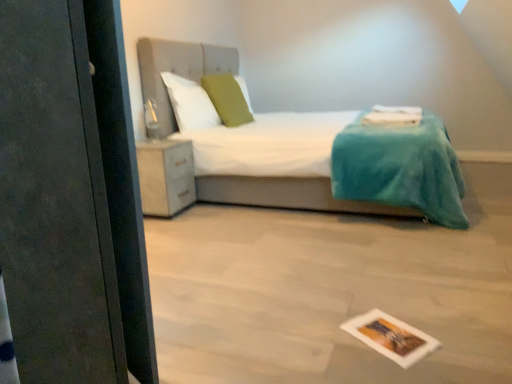
Question: Are matte white cabinet at lower left and green fabric pillow at center, the 1th pillow positioned from the right, beside each other?

Choices:
 (A) yes
 (B) no

Answer: (B)

Question: From the image's perspective, does matte white cabinet at lower left appear lower than green fabric pillow at center, the 1th pillow positioned from the right?

Choices:
 (A) no
 (B) yes

Answer: (B)

Question: Is matte white cabinet at lower left thinner than green fabric pillow at center, the 2th pillow in the left-to-right sequence?

Choices:
 (A) no
 (B) yes

Answer: (A)

Question: Can you confirm if matte white cabinet at lower left is positioned to the left of green fabric pillow at center, the 2th pillow in the left-to-right sequence?

Choices:
 (A) no
 (B) yes

Answer: (B)

Question: Does matte white cabinet at lower left have a smaller size compared to green fabric pillow at center, the 1th pillow positioned from the right?

Choices:
 (A) no
 (B) yes

Answer: (A)

Question: Is matte white cabinet at lower left facing towards green fabric pillow at center, the 1th pillow positioned from the right?

Choices:
 (A) yes
 (B) no

Answer: (B)

Question: Can you confirm if printed paper postcard at lower center is thinner than white fabric bed at center?

Choices:
 (A) no
 (B) yes

Answer: (B)

Question: Can you confirm if printed paper postcard at lower center is smaller than white fabric bed at center?

Choices:
 (A) yes
 (B) no

Answer: (A)

Question: From a real-world perspective, is printed paper postcard at lower center located beneath white fabric bed at center?

Choices:
 (A) yes
 (B) no

Answer: (A)

Question: Does printed paper postcard at lower center turn towards white fabric bed at center?

Choices:
 (A) yes
 (B) no

Answer: (B)

Question: Is printed paper postcard at lower center positioned with its back to white fabric bed at center?

Choices:
 (A) yes
 (B) no

Answer: (B)

Question: Can you confirm if printed paper postcard at lower center is wider than white fabric bed at center?

Choices:
 (A) no
 (B) yes

Answer: (A)

Question: Considering the relative sizes of matte white cabinet at lower left and white fabric bed at center in the image provided, is matte white cabinet at lower left shorter than white fabric bed at center?

Choices:
 (A) no
 (B) yes

Answer: (B)